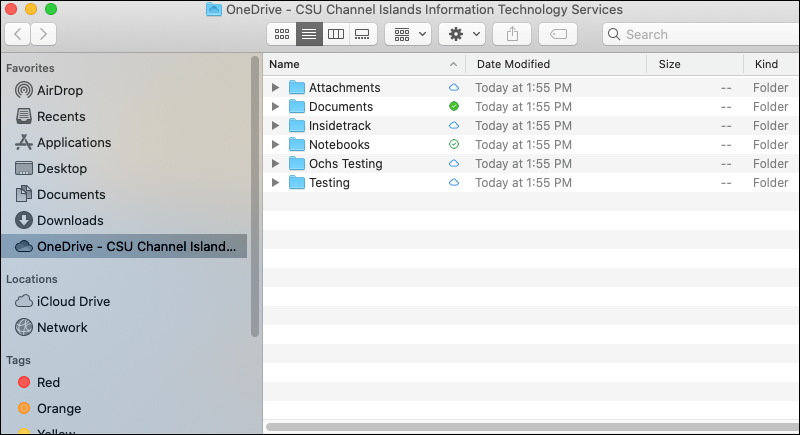
The height and width of the screenshot is (435, 800). What are the coordinates of `blue folders` in the screenshot? It's located at (296, 90), (300, 107), (300, 123), (300, 143), (300, 164), (298, 187).